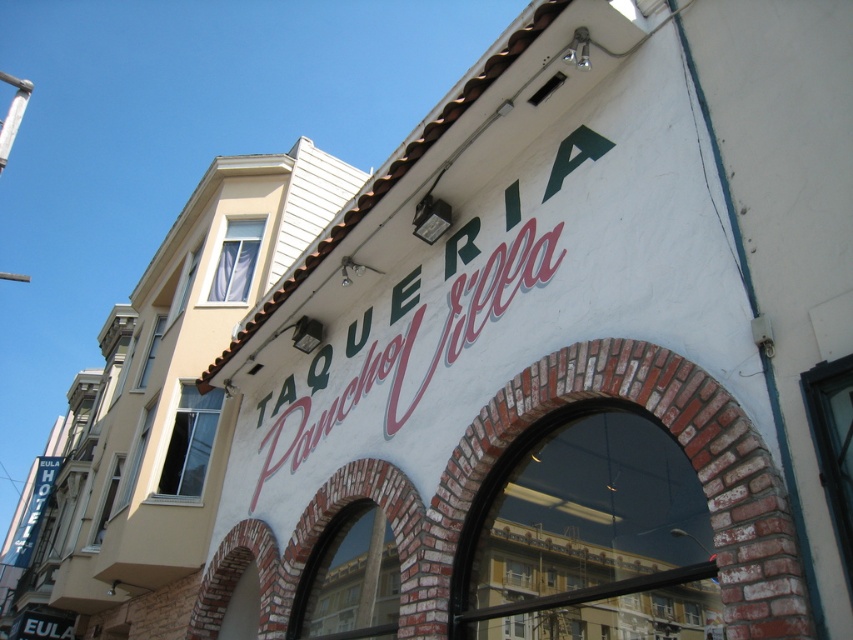
You are a painter who needs to know which sign requires more paint to cover its entire surface. Based on the scene, which one between the green painted sign at upper center and the blue fabric hotel sign at left needs more paint?

The blue fabric hotel sign at left requires more paint because its width is greater than the green painted sign at upper center, meaning it has a larger surface area.

You are standing in front of the restaurant and need to locate the green painted sign at upper center. Based on the coordinates provided, can you determine its position relative to the entrance archway?

The green painted sign at upper center is located at coordinates point (410,346), which places it above the entrance archway since the coordinates are positioned higher than the archway.

You are standing at the entrance of the Taqueria Pancho Villa and looking towards the neighboring beige building. There are two points marked on the ground in front of you at coordinates point (x=532, y=220) and point (x=44, y=483). Which point is closer to your current position?

Point (x=532, y=220) is closer to your current position because it is in front of point (x=44, y=483), meaning it is nearer to you.